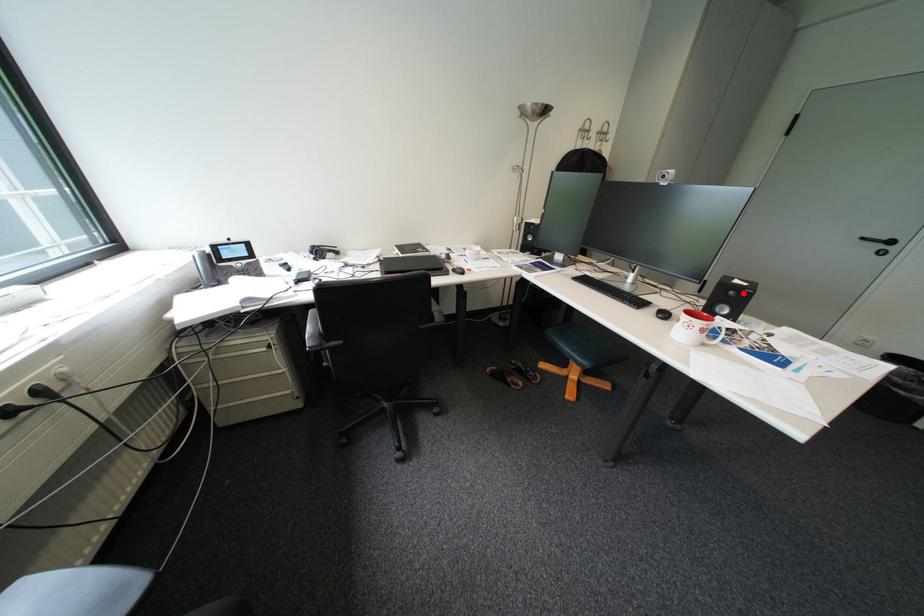
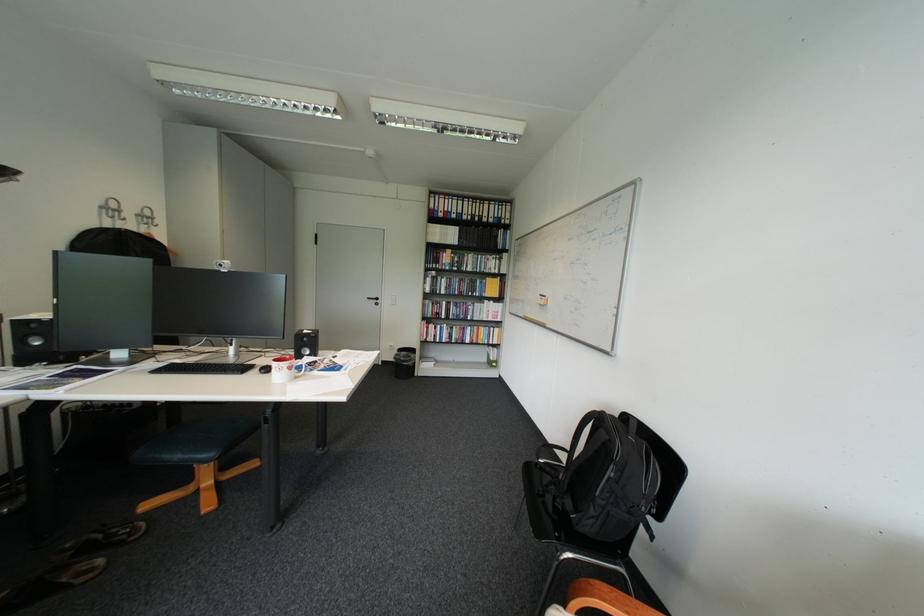
The point at the highlighted location is marked in the first image. Where is the corresponding point in the second image?

(317, 339)